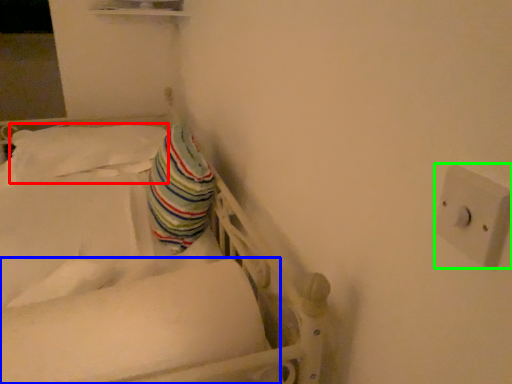
Question: Estimate the real-world distances between objects in this image. Which object is farther from pillow (highlighted by a red box), mattress (highlighted by a blue box) or electric outlet (highlighted by a green box)?

Choices:
 (A) mattress
 (B) electric outlet

Answer: (B)